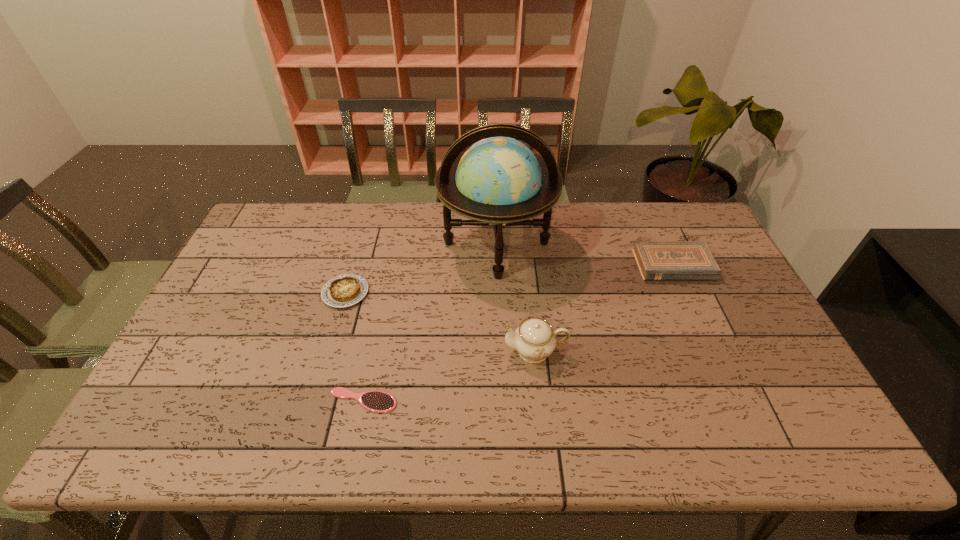
The width and height of the screenshot is (960, 540). In order to click on the tallest object in this screenshot , I will do `click(497, 182)`.

You are a GUI agent. You are given a task and a screenshot of the screen. Output one action in this format:
    pyautogui.click(x=<x>, y=<y>)
    Task: Click on the fourth farthest object
    The width and height of the screenshot is (960, 540).
    Given the screenshot: What is the action you would take?
    pyautogui.click(x=534, y=339)

Locate an element on the screen. The height and width of the screenshot is (540, 960). chinaware is located at coordinates (534, 339).

Locate an element on the screen. Image resolution: width=960 pixels, height=540 pixels. Bible is located at coordinates (657, 260).

Where is `the rightmost object`? The height and width of the screenshot is (540, 960). the rightmost object is located at coordinates (657, 260).

The image size is (960, 540). Identify the location of the fourth tallest object. (345, 290).

Locate an element on the screen. The image size is (960, 540). the nearest object is located at coordinates pyautogui.click(x=375, y=401).

Locate an element on the screen. The height and width of the screenshot is (540, 960). the shortest object is located at coordinates (375, 401).

Where is `free spot located on the surface of the tallest object`? This screenshot has height=540, width=960. free spot located on the surface of the tallest object is located at coordinates (500, 345).

Locate an element on the screen. This screenshot has height=540, width=960. free space located 0.250m at the spout of the fourth farthest object is located at coordinates (409, 350).